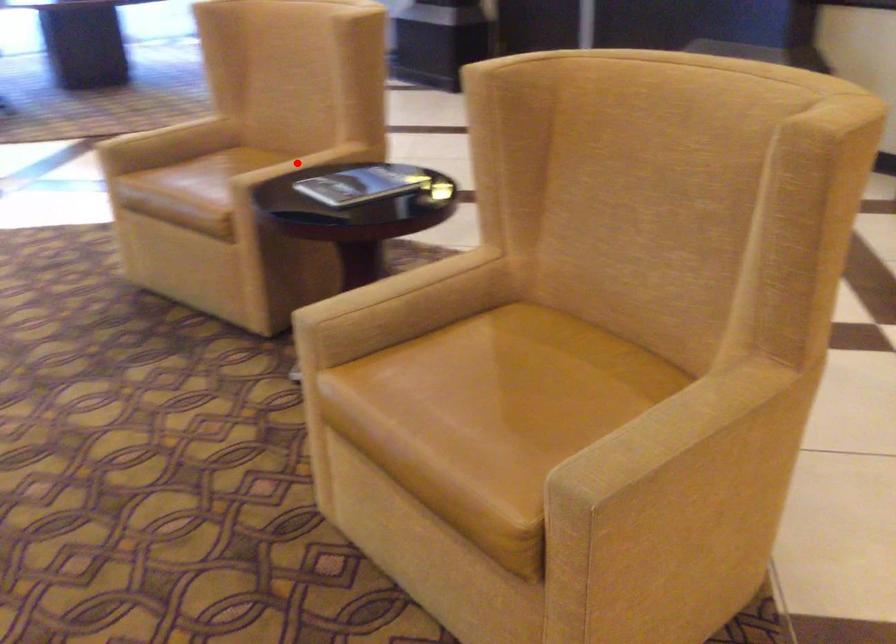
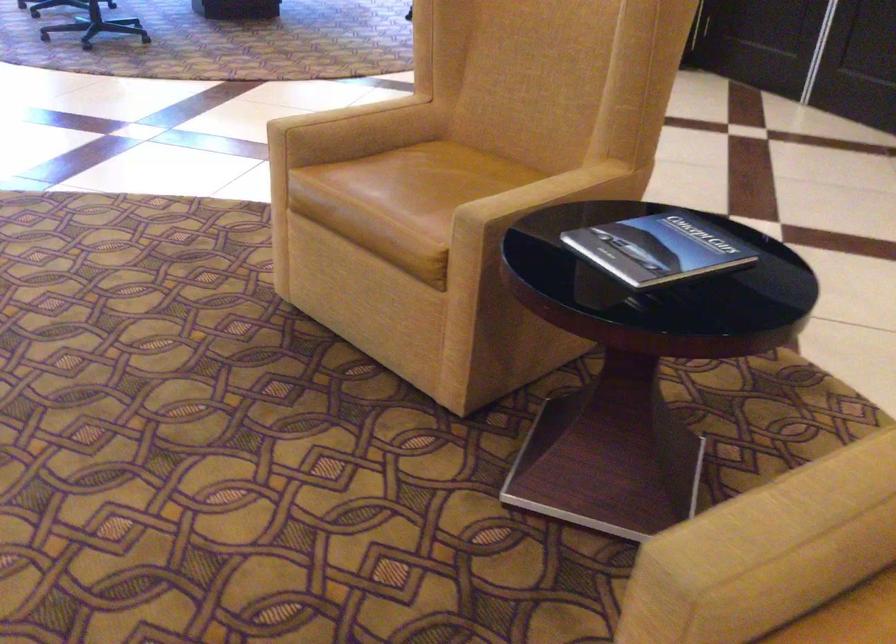
Question: I am providing you with two images of the same scene from different viewpoints. A red point is marked on the first image. At the location where the point appears in image 1, is it still visible in image 2?

Choices:
 (A) Yes
 (B) No

Answer: (A)